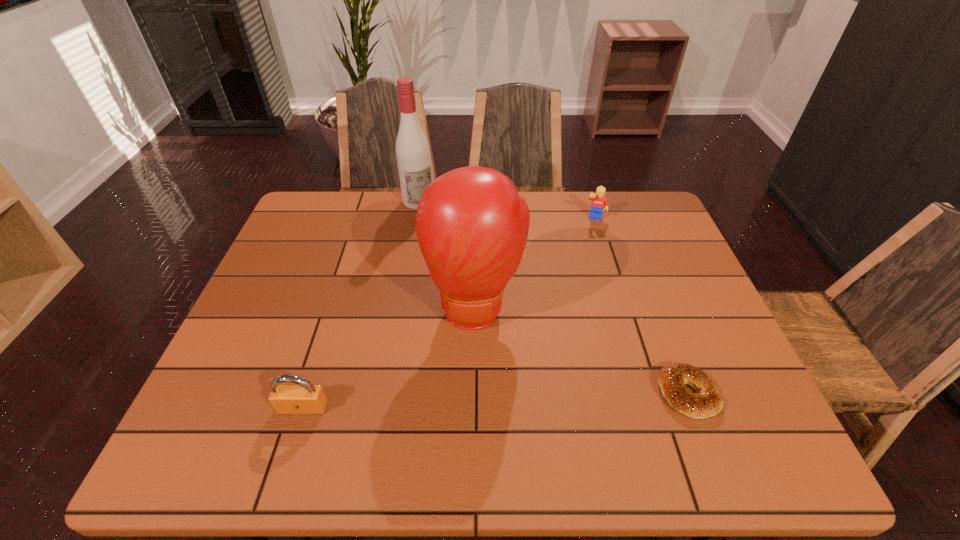
Image resolution: width=960 pixels, height=540 pixels. What are the coordinates of `the leftmost object` in the screenshot? It's located at (303, 398).

Where is `the shortest object`? the shortest object is located at coordinates [x=672, y=378].

Identify the location of the third object from right to left. (472, 227).

Where is `the third farthest object`? The image size is (960, 540). the third farthest object is located at coordinates point(472,227).

The image size is (960, 540). Find the location of `the farthest object`. the farthest object is located at coordinates (412, 149).

Where is `the second object from left to right`? the second object from left to right is located at coordinates (412, 149).

Locate an element on the screen. This screenshot has height=540, width=960. the fourth nearest object is located at coordinates (599, 203).

Identify the location of vacant space situated on the back of the shortest object. (664, 333).

I want to click on blank area located 0.130m on the striking surface of the boxing glove, so coord(476,394).

Identify the location of free space located on the striking surface of the boxing glove. (476, 370).